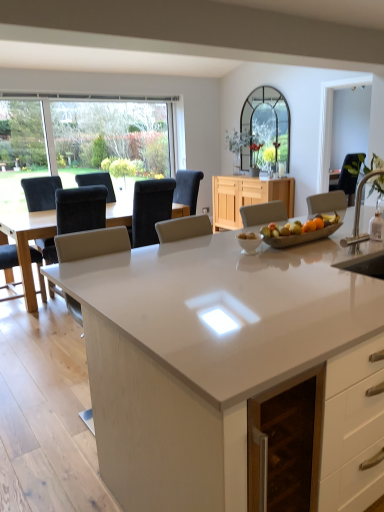
Question: Does transparent glass window at upper left have a lesser width compared to light wood cabinet at center?

Choices:
 (A) yes
 (B) no

Answer: (A)

Question: Could you tell me if transparent glass window at upper left is facing light wood cabinet at center?

Choices:
 (A) yes
 (B) no

Answer: (A)

Question: From a real-world perspective, is transparent glass window at upper left over light wood cabinet at center?

Choices:
 (A) no
 (B) yes

Answer: (B)

Question: Considering the relative positions of transparent glass window at upper left and light wood cabinet at center in the image provided, is transparent glass window at upper left in front of light wood cabinet at center?

Choices:
 (A) yes
 (B) no

Answer: (A)

Question: Can you confirm if transparent glass window at upper left is taller than light wood cabinet at center?

Choices:
 (A) yes
 (B) no

Answer: (A)

Question: Is transparent glass window at upper left oriented away from light wood cabinet at center?

Choices:
 (A) no
 (B) yes

Answer: (A)

Question: Does matte black chair at left, the 2th chair when ordered from left to right, lie in front of transparent glass window at upper left?

Choices:
 (A) yes
 (B) no

Answer: (A)

Question: Can you confirm if matte black chair at left, positioned as the third chair in right-to-left order, is positioned to the right of transparent glass window at upper left?

Choices:
 (A) yes
 (B) no

Answer: (A)

Question: Is matte black chair at left, the 2th chair when ordered from left to right, completely or partially outside of transparent glass window at upper left?

Choices:
 (A) no
 (B) yes

Answer: (B)

Question: Does matte black chair at left, positioned as the third chair in right-to-left order, have a greater width compared to transparent glass window at upper left?

Choices:
 (A) yes
 (B) no

Answer: (A)

Question: Is matte black chair at left, the 2th chair when ordered from left to right, placed right next to transparent glass window at upper left?

Choices:
 (A) no
 (B) yes

Answer: (A)

Question: Can you confirm if matte black chair at left, positioned as the third chair in right-to-left order, is taller than transparent glass window at upper left?

Choices:
 (A) no
 (B) yes

Answer: (A)

Question: From the image's perspective, is matte black chair at left, positioned as the third chair in right-to-left order, located beneath light wood cabinet at center?

Choices:
 (A) no
 (B) yes

Answer: (B)